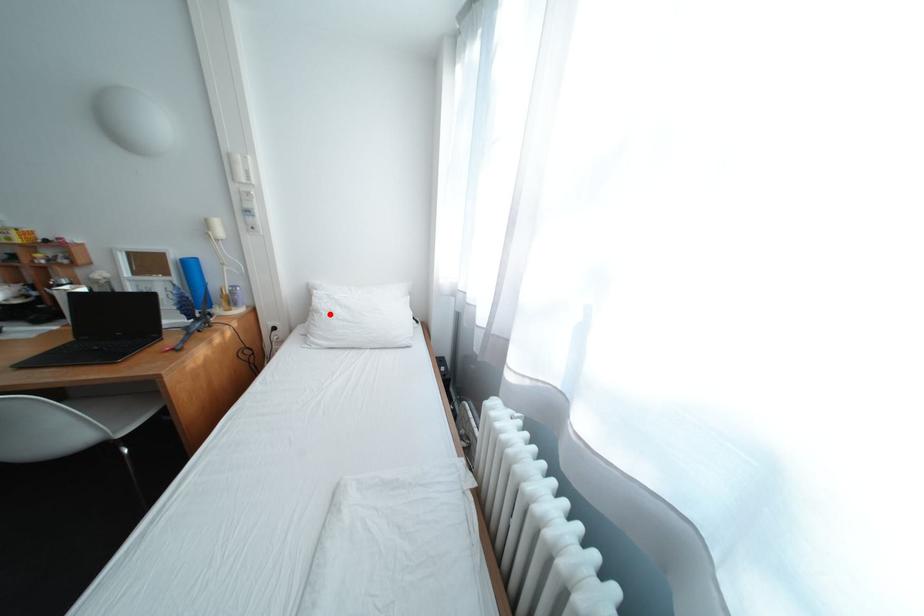
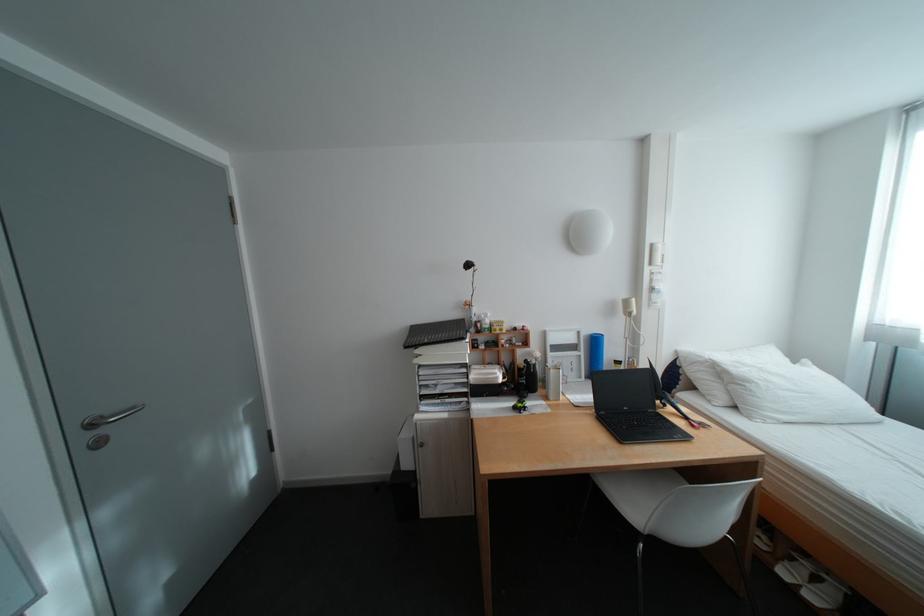
Where in the second image is the point corresponding to the highlighted location from the first image?

(761, 384)